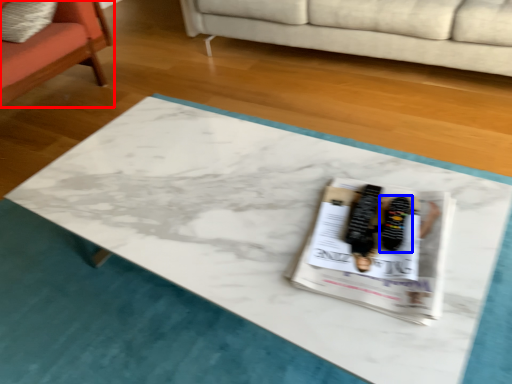
Question: Which point is further to the camera, chair (highlighted by a red box) or footwear (highlighted by a blue box)?

Choices:
 (A) chair
 (B) footwear

Answer: (A)